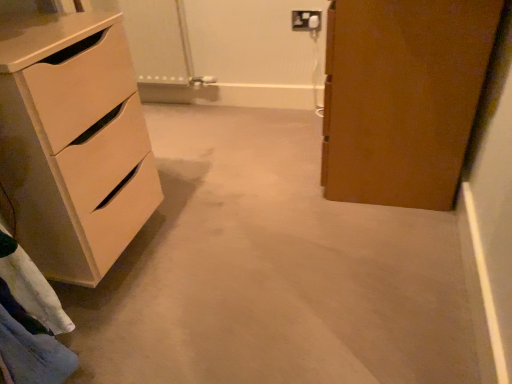
Question: From the image's perspective, is beige carpet at center located above or below white plastic electric outlet at upper center?

Choices:
 (A) below
 (B) above

Answer: (A)

Question: Is beige carpet at center taller or shorter than white plastic electric outlet at upper center?

Choices:
 (A) tall
 (B) short

Answer: (B)

Question: Which is nearer to the beige carpet at center?

Choices:
 (A) matte white chest of drawers at left
 (B) white plastic electric outlet at upper center

Answer: (A)

Question: Which is farther from the matte white chest of drawers at left?

Choices:
 (A) beige carpet at center
 (B) white plastic electric outlet at upper center

Answer: (B)